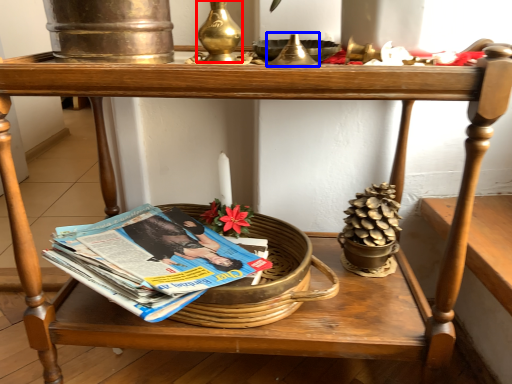
Question: Which of the following is the farthest to the observer, candle holder (highlighted by a red box) or candle holder (highlighted by a blue box)?

Choices:
 (A) candle holder
 (B) candle holder

Answer: (A)